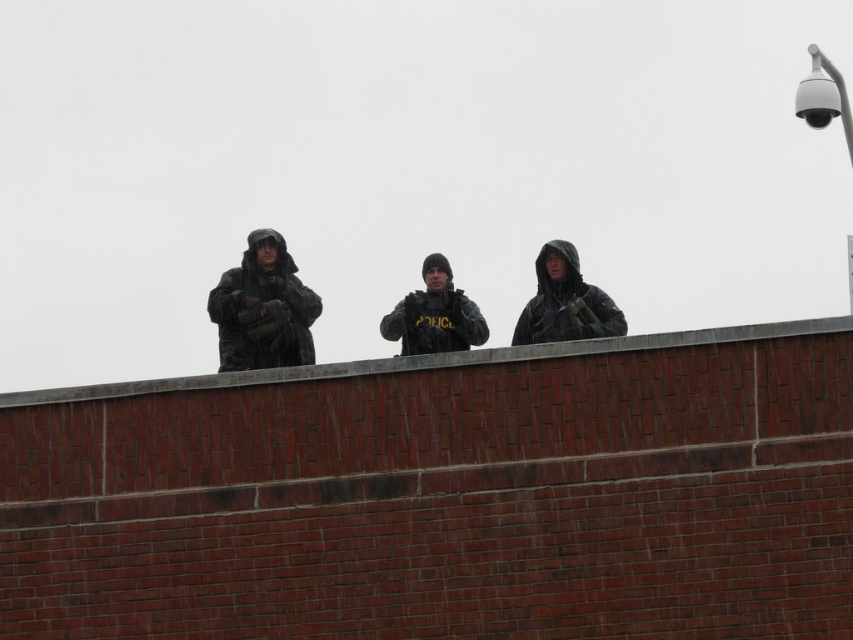
You are a photographer trying to capture a group photo of the camouflage fabric uniform at center and the matte black jacket at center. If you want to ensure both subjects are fully visible in the frame without cropping, which uniform should you position closer to the camera to avoid overcrowding?

The camouflage fabric uniform at center is narrower than the matte black jacket at center. To avoid overcrowding, position the wider matte black jacket at center closer to the camera so it takes up more space, allowing the narrower camouflage fabric uniform at center to fit comfortably within the frame.

You are a drone operator trying to identify two individuals on a brick wall. You see a matte black jacket at center and a camouflage uniform at center. Which one is positioned lower?

The matte black jacket at center is located below the camouflage uniform at center, so it is positioned lower.